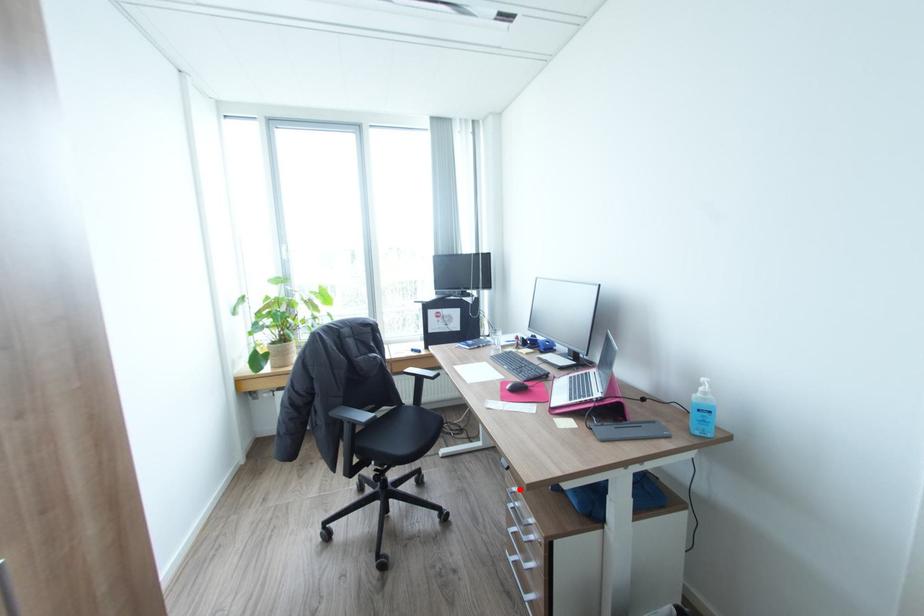
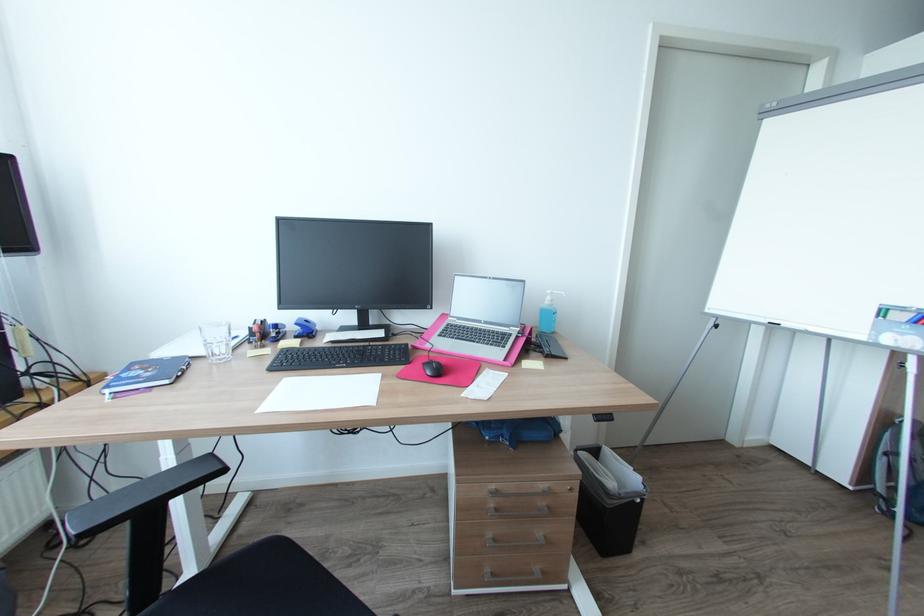
Locate, in the second image, the point that corresponds to the highlighted location in the first image.

(497, 487)